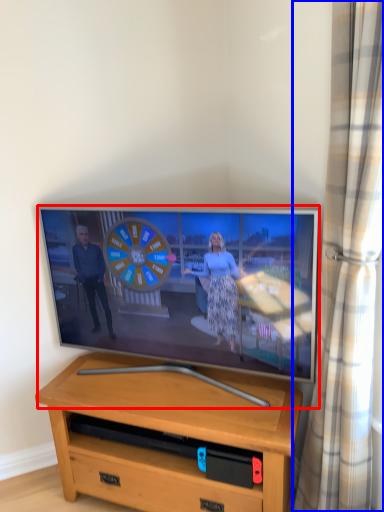
Question: Which point is further to the camera, television (highlighted by a red box) or curtain (highlighted by a blue box)?

Choices:
 (A) television
 (B) curtain

Answer: (A)